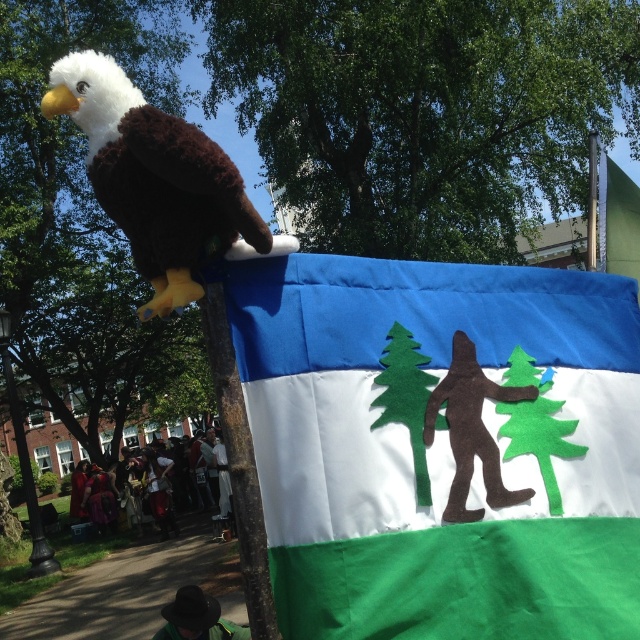
Question: Is blue felt flag at center bigger than fluffy brown and white eagle at upper left?

Choices:
 (A) no
 (B) yes

Answer: (B)

Question: Which of the following is the farthest from the observer?

Choices:
 (A) brown wood pole at center
 (B) fluffy brown and white eagle at upper left

Answer: (A)

Question: Considering the real-world distances, which object is closest to the fluffy brown and white eagle at upper left?

Choices:
 (A) brown wood pole at center
 (B) blue felt flag at center

Answer: (A)

Question: Which object is closer to the camera taking this photo?

Choices:
 (A) brown wood pole at center
 (B) blue felt flag at center

Answer: (B)

Question: Does blue felt flag at center have a greater width compared to brown wood pole at center?

Choices:
 (A) yes
 (B) no

Answer: (A)

Question: Is fluffy brown and white eagle at upper left positioned before brown wood pole at center?

Choices:
 (A) no
 (B) yes

Answer: (B)